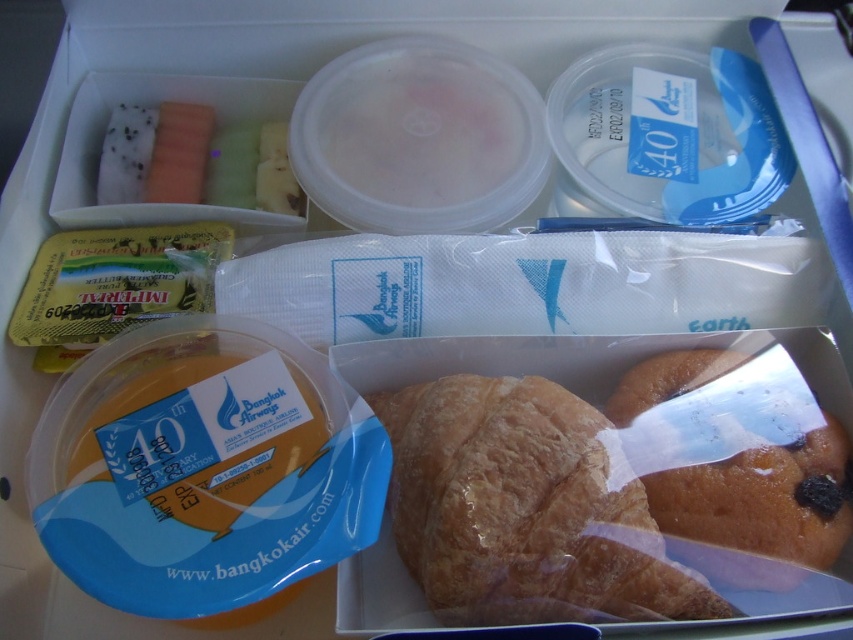
Does golden brown flaky croissant at center have a smaller size compared to golden brown flaky croissant at lower right?

No.

Is golden brown flaky croissant at center below golden brown flaky croissant at lower right?

Yes, golden brown flaky croissant at center is below golden brown flaky croissant at lower right.

Does point (714, 605) come behind point (630, 396)?

No, (714, 605) is in front of (630, 396).

Locate an element on the screen. golden brown flaky croissant at center is located at coordinates (523, 509).